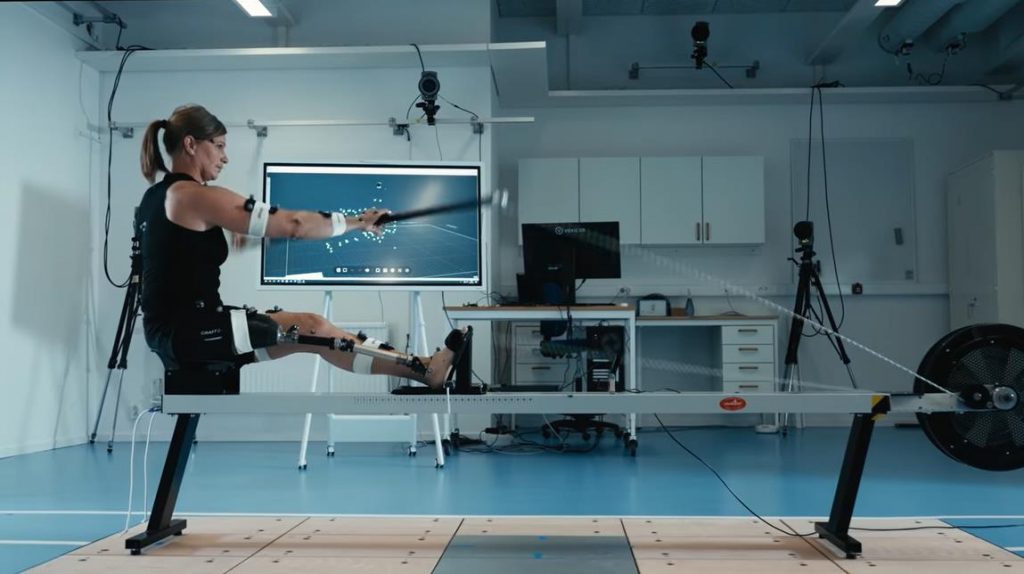
I want to click on seat, so click(x=211, y=381).